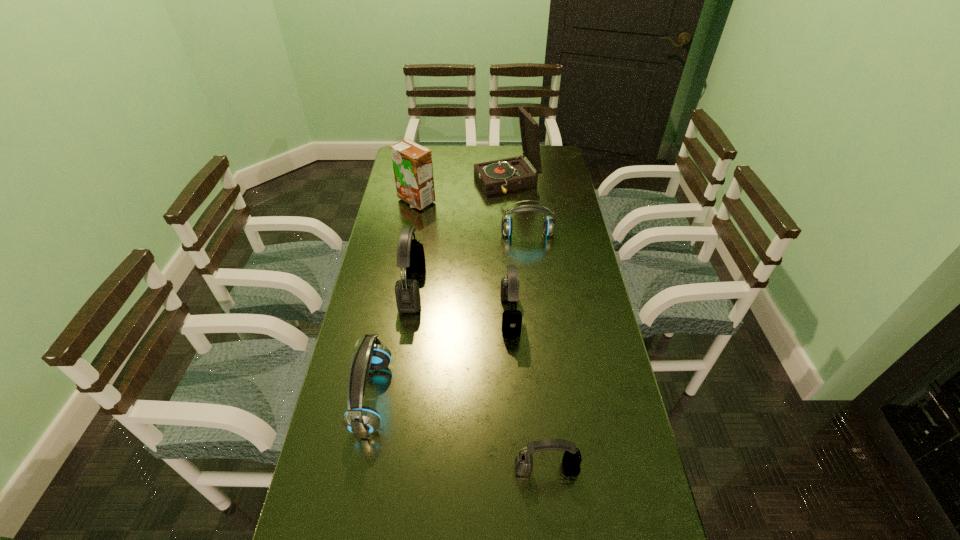
Choose which blue headset is the second nearest neighbor to the tallest object. Please provide its 2D coordinates. Your answer should be formatted as a tuple, i.e. [(x, y)], where the tuple contains the x and y coordinates of a point satisfying the conditions above.

[(362, 421)]